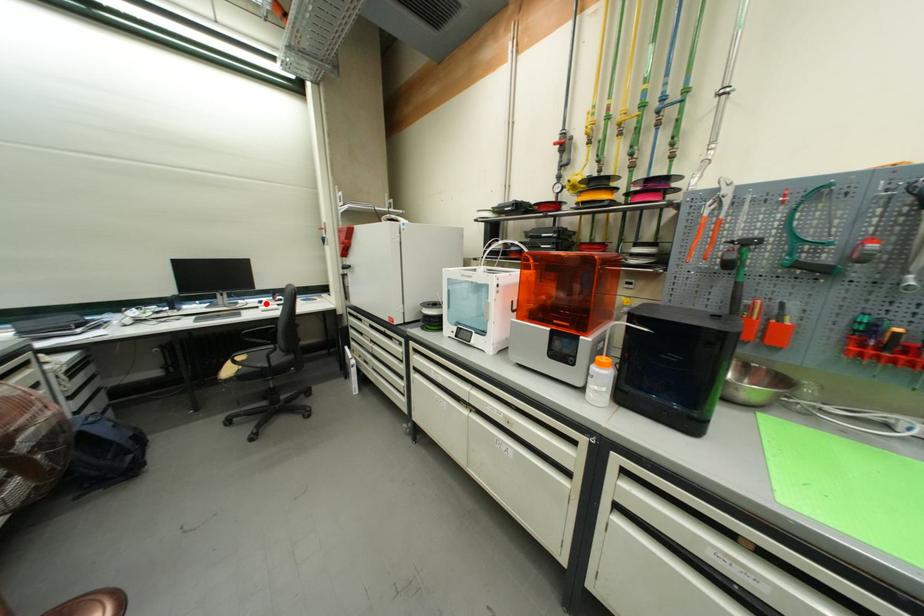
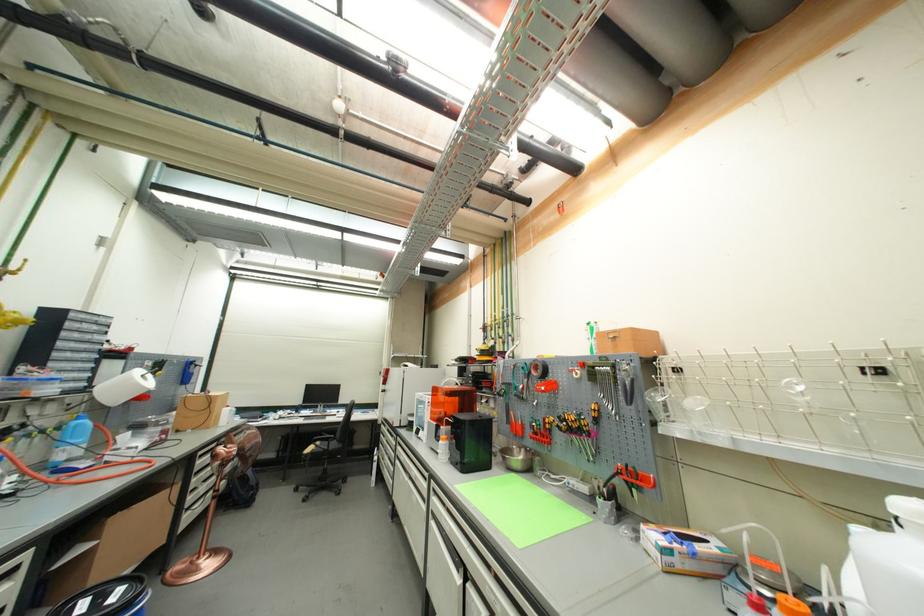
Question: I am providing you with two images of the same scene from different viewpoints. Given a red point in image1, look at the same physical point in image2. Is it:

Choices:
 (A) Closer to the viewpoint
 (B) Farther from the viewpoint

Answer: (B)